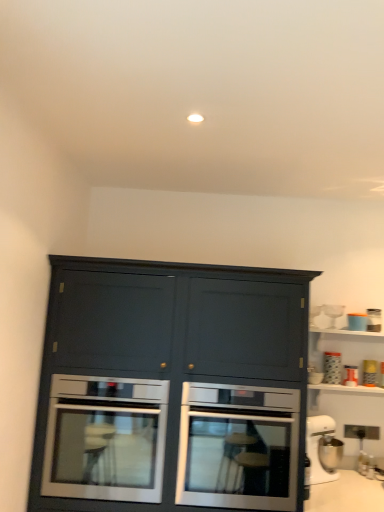
Question: From their relative heights in the image, would you say metallic silver toaster at upper right, positioned as the second appliance in bottom-to-top order, is taller or shorter than orange matte jar at upper right, the third appliance when ordered from bottom to top?

Choices:
 (A) tall
 (B) short

Answer: (B)

Question: Is metallic silver toaster at upper right, positioned as the second appliance in bottom-to-top order, to the left or to the right of orange matte jar at upper right, the third appliance when ordered from bottom to top, in the image?

Choices:
 (A) left
 (B) right

Answer: (B)

Question: Estimate the real-world distances between objects in this image. Which object is farther from the metallic silver toaster at upper right, which ranks as the 6th appliance in top-to-bottom order?

Choices:
 (A) metallic silver toaster at upper right, acting as the sixth appliance starting from the bottom
 (B) stainless steel oven at center, which is counted as the 1th oven, starting from the right
 (C) white plastic stand mixer at lower right, which is the 7th appliance from top to bottom
 (D) matte blue container at upper right, the 3th appliance when ordered from top to bottom
 (E) stainless steel oven at lower left, which is the 2th oven in right-to-left order

Answer: (E)

Question: Considering the real-world distances, which object is closest to the matte white jar at upper right, the fourth appliance viewed from the top?

Choices:
 (A) clear glass wine glass at upper right, which is the 1th appliance in top-to-bottom order
 (B) white plastic stand mixer at lower right, which is the 7th appliance from top to bottom
 (C) matte blue container at upper right, arranged as the fifth appliance when ordered from the bottom
 (D) orange matte jar at upper right, the 5th appliance in the top-to-bottom sequence
 (E) stainless steel oven at lower left, which is the 2th oven in right-to-left order

Answer: (D)